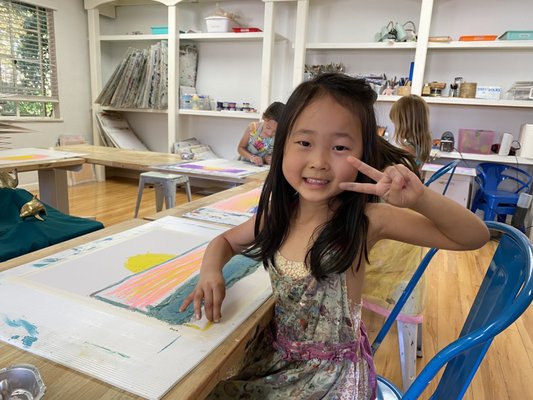
Identify the location of blue chairs. (512, 314), (494, 184), (503, 208), (441, 170).